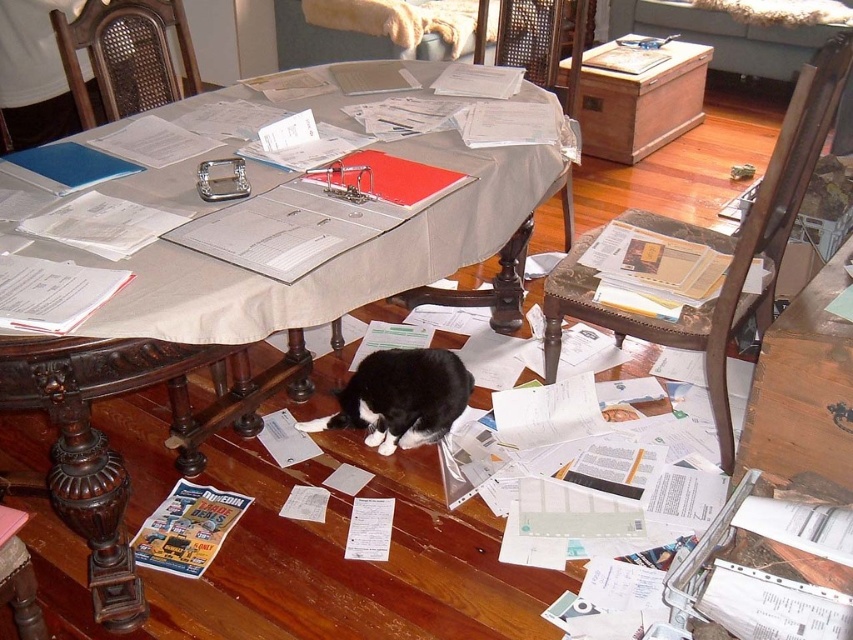
In the scene shown: You are organizing the dining room and need to move the black fur cat at center to a safer area. Since the smooth beige table at center is in the way, can you lift the cat over the table without it touching the table?

The smooth beige table at center is bigger than the black fur cat at center, so lifting the cat over the table would require clearing space above the table. However, since the table itself is larger, there might not be enough clearance unless items on the table are moved first. The answer depends on the height and arrangement of the table legs and the cat.

You are trying to reach the black fur cat at center under the table. Considering the height of the smooth beige table at center, can you comfortably place your hand under the table to pet the cat without bending down too much?

The smooth beige table at center is much taller than the black fur cat at center, so the space under the table might be limited. You may need to bend down significantly to reach the cat.

You are standing in the dining room and want to pick up two items located at point (x=125, y=321) and point (x=381, y=374). Which point is closer to you?

Point (x=125, y=321) is in front of point (x=381, y=374), so it is closer to you.